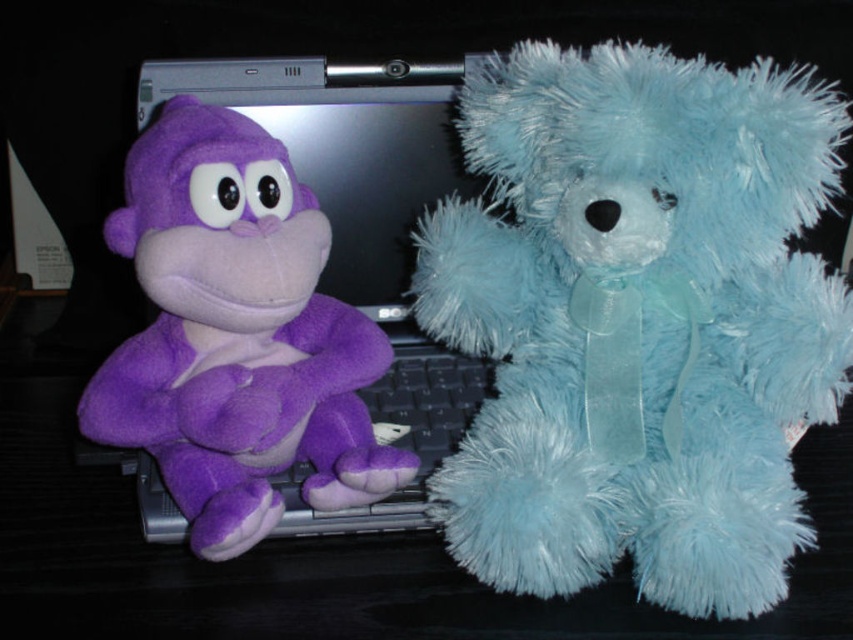
Consider the image. Is purple plush monkey at left further to camera compared to purple fabric keyboard at left?

No, purple plush monkey at left is in front of purple fabric keyboard at left.

Which is more to the left, purple plush monkey at left or purple fabric keyboard at left?

purple plush monkey at left is more to the left.

The height and width of the screenshot is (640, 853). In order to click on purple plush monkey at left in this screenshot , I will do `click(236, 336)`.

This screenshot has height=640, width=853. Identify the location of purple plush monkey at left. (236, 336).

Which of these two, fuzzy light blue teddy bear at right or purple plush monkey at left, stands taller?

fuzzy light blue teddy bear at right is taller.

Is point (596, 120) behind point (213, 419)?

Yes, point (596, 120) is farther from viewer.

This screenshot has height=640, width=853. What are the coordinates of `fuzzy light blue teddy bear at right` in the screenshot? It's located at (637, 321).

Can you confirm if fuzzy light blue teddy bear at right is positioned above purple fabric keyboard at left?

Yes, fuzzy light blue teddy bear at right is above purple fabric keyboard at left.

Measure the distance between fuzzy light blue teddy bear at right and purple fabric keyboard at left.

fuzzy light blue teddy bear at right is 7.62 inches from purple fabric keyboard at left.

Where is `fuzzy light blue teddy bear at right`? The width and height of the screenshot is (853, 640). fuzzy light blue teddy bear at right is located at coordinates (637, 321).